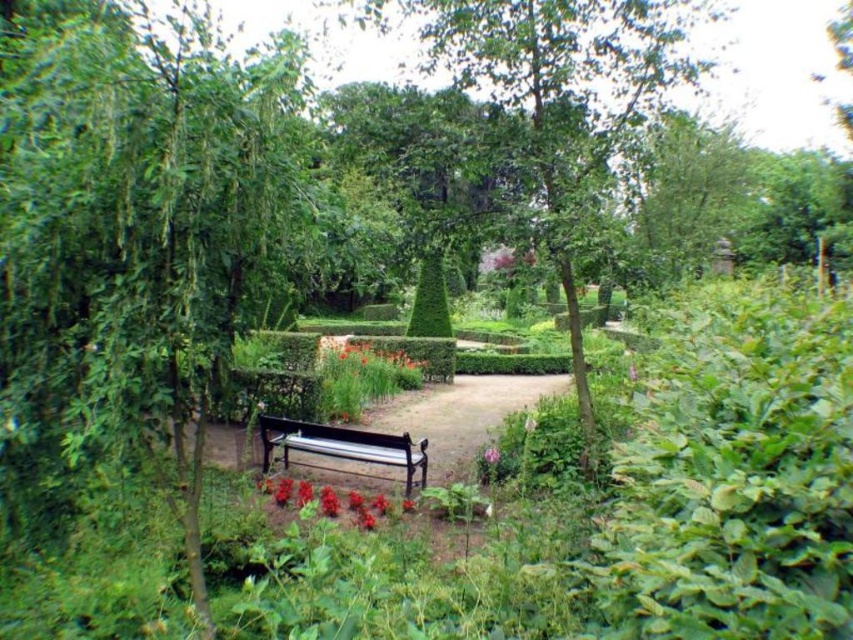
Is green leafy tree at center taller than pink matte flower at center?

Yes.

Measure the distance between point (x=550, y=20) and camera.

The distance of point (x=550, y=20) from camera is 4.90 meters.

The width and height of the screenshot is (853, 640). Find the location of `green leafy tree at center`. green leafy tree at center is located at coordinates (560, 99).

Consider the image. Who is more distant from viewer, (102, 365) or (494, 451)?

The point (494, 451) is more distant.

Between point (106, 44) and point (492, 449), which one is positioned in front?

Point (106, 44) is in front.

Which is in front, point (108, 435) or point (486, 451)?

Point (108, 435) is in front.

Where is `green leafy tree at left`? green leafy tree at left is located at coordinates (132, 236).

Can you confirm if black polished wood bench at center is wider than orange matte flower at center?

Incorrect, black polished wood bench at center's width does not surpass orange matte flower at center's.

Who is taller, black polished wood bench at center or orange matte flower at center?

With more height is black polished wood bench at center.

Does point (363, 445) lie in front of point (380, 337)?

Yes, point (363, 445) is closer to viewer.

Locate an element on the screen. The height and width of the screenshot is (640, 853). black polished wood bench at center is located at coordinates (343, 445).